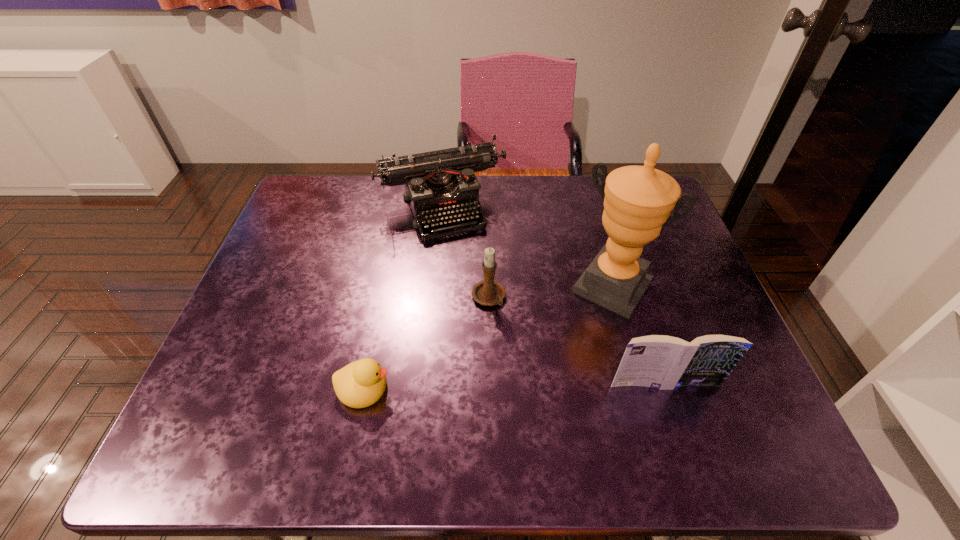
The image size is (960, 540). In order to click on object that is at the near right corner in this screenshot , I will do `click(664, 362)`.

In the image, there is a desktop. At what (x,y) coordinates should I click in order to perform the action: click on vacant area at the far edge. Please return your answer as a coordinate pair (x, y). Looking at the image, I should click on coord(364,215).

The height and width of the screenshot is (540, 960). I want to click on free space at the near edge, so pos(479,389).

You are a GUI agent. You are given a task and a screenshot of the screen. Output one action in this format:
    pyautogui.click(x=<x>, y=<y>)
    Task: Click on the free space at the left edge of the desktop
    This screenshot has height=540, width=960.
    Given the screenshot: What is the action you would take?
    pyautogui.click(x=314, y=243)

Locate an element on the screen. free space at the right edge of the desktop is located at coordinates (654, 245).

You are a GUI agent. You are given a task and a screenshot of the screen. Output one action in this format:
    pyautogui.click(x=<x>, y=<y>)
    Task: Click on the blank space at the far left corner of the desktop
    
    Given the screenshot: What is the action you would take?
    pyautogui.click(x=327, y=199)

At what (x,y) coordinates should I click in order to perform the action: click on blank space at the near right corner of the desktop. Please return your answer as a coordinate pair (x, y). Looking at the image, I should click on (680, 390).

At what (x,y) coordinates should I click in order to perform the action: click on free spot between the book and the shortest object. Please return your answer as a coordinate pair (x, y). The width and height of the screenshot is (960, 540). Looking at the image, I should click on (515, 386).

This screenshot has height=540, width=960. What are the coordinates of `vacant area that lies between the candle holder and the book` in the screenshot? It's located at (576, 341).

Image resolution: width=960 pixels, height=540 pixels. What are the coordinates of `vacant area that lies between the typewriter and the award` in the screenshot? It's located at (527, 247).